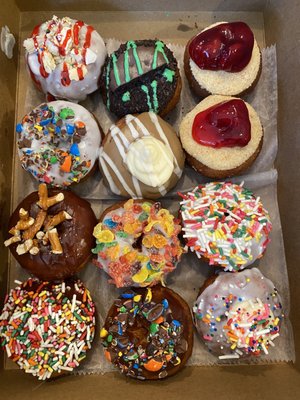
In order to click on box in this screenshot , I will do `click(278, 31)`.